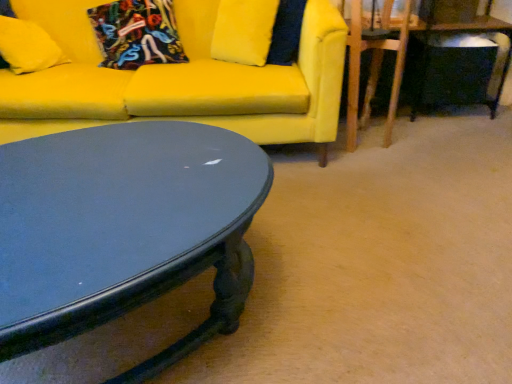
This screenshot has height=384, width=512. What are the coordinates of `vacant area that lies between glossy dark wood coffee table at lower left and wooden swivel chair at right` in the screenshot? It's located at (323, 197).